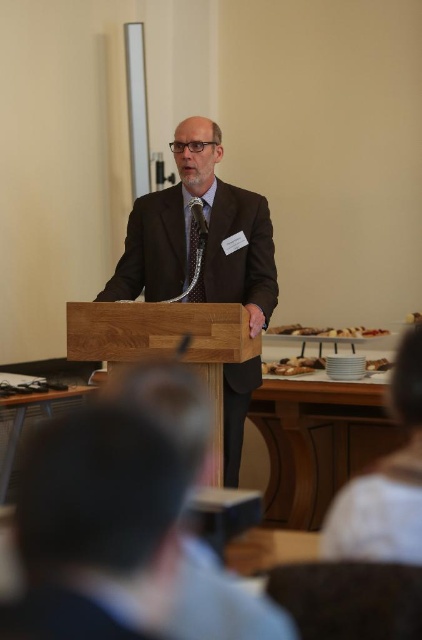
You are organizing a small meeting and need to place both the wooden podium at center and the brown crumbly pastry at center on a table. The table has limited space. Which object should you place first to ensure both fit?

The wooden podium at center is bigger than the brown crumbly pastry at center, so you should place the wooden podium at center first to ensure both fit on the table.

You are an event organizer who needs to ensure all speakers have enough space on the podium. The podium has a limited space of 1 meter in width. Given the sizes of the matte brown suit at center and white fabric at lower right, will both items fit side by side on the podium?

The matte brown suit at center is larger than the white fabric at lower right. Since the podium has a width of 1 meter, it depends on their exact dimensions. However, without specific measurements, we cannot confirm if they will fit. Please provide more details about their sizes.